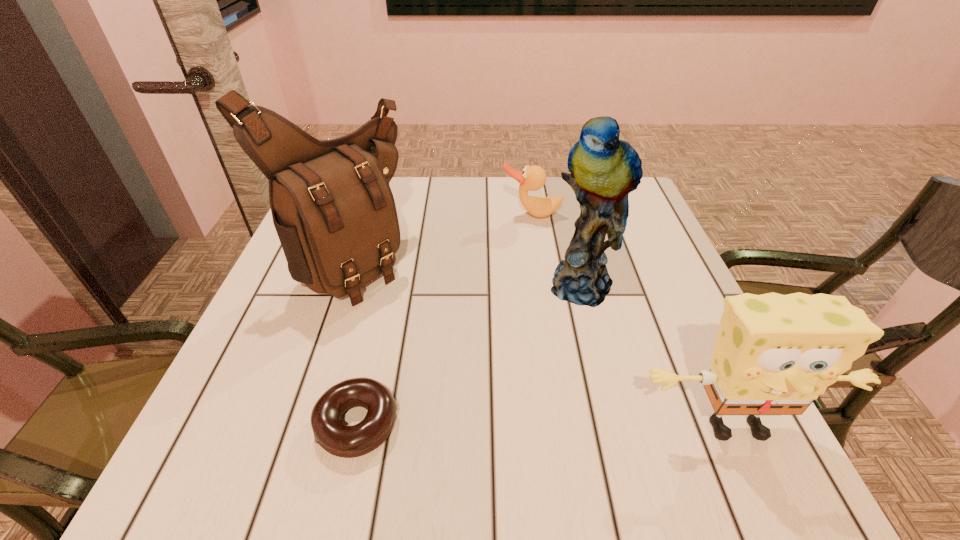
What are the coordinates of `sponge located in the right edge section of the desktop` in the screenshot? It's located at (775, 354).

Locate an element on the screen. The height and width of the screenshot is (540, 960). parrot situated at the right edge is located at coordinates (604, 170).

Find the location of a particular element. Image resolution: width=960 pixels, height=540 pixels. object situated at the far left corner is located at coordinates click(x=334, y=212).

What are the coordinates of `object at the near right corner` in the screenshot? It's located at (775, 354).

Identify the location of free space at the far edge of the desktop. The image size is (960, 540). (519, 206).

Identify the location of vacant space at the left edge of the desktop. (319, 361).

Locate an element on the screen. This screenshot has width=960, height=540. free location at the right edge of the desktop is located at coordinates (670, 296).

I want to click on free space between the duck and the shortest object, so click(x=444, y=319).

Locate an element on the screen. Image resolution: width=960 pixels, height=540 pixels. unoccupied area between the shoulder bag and the parrot is located at coordinates (468, 273).

The image size is (960, 540). Find the location of `vacant area that lies between the second shortest object and the parrot`. vacant area that lies between the second shortest object and the parrot is located at coordinates (559, 250).